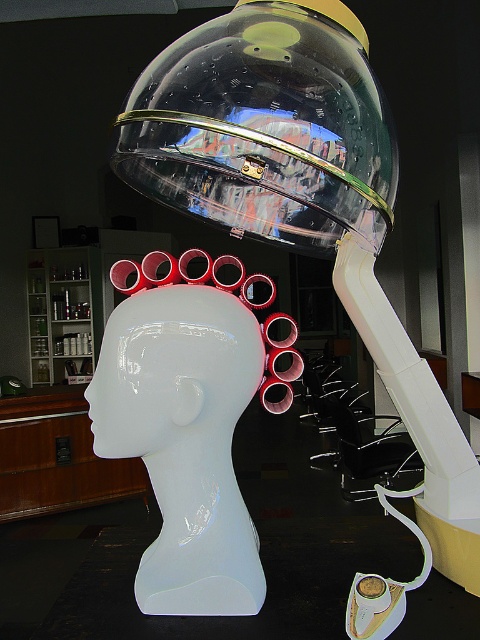
Question: Does transparent plastic dome at upper center have a larger size compared to glossy white head at center?

Choices:
 (A) no
 (B) yes

Answer: (B)

Question: Does transparent plastic dome at upper center have a smaller size compared to glossy white head at center?

Choices:
 (A) yes
 (B) no

Answer: (B)

Question: Is transparent plastic dome at upper center positioned behind glossy white head at center?

Choices:
 (A) yes
 (B) no

Answer: (B)

Question: Which point is farther to the camera?

Choices:
 (A) (184, 198)
 (B) (152, 384)

Answer: (A)

Question: Among these points, which one is farthest from the camera?

Choices:
 (A) (x=257, y=189)
 (B) (x=210, y=344)

Answer: (A)